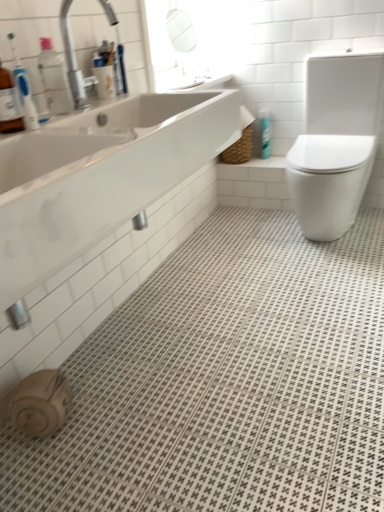
Question: Is silver metallic faucet at upper left to the left of blue glossy spray can at upper right from the viewer's perspective?

Choices:
 (A) yes
 (B) no

Answer: (A)

Question: From the image's perspective, is silver metallic faucet at upper left below blue glossy spray can at upper right?

Choices:
 (A) no
 (B) yes

Answer: (B)

Question: Considering the relative sizes of silver metallic faucet at upper left and blue glossy spray can at upper right in the image provided, is silver metallic faucet at upper left wider than blue glossy spray can at upper right?

Choices:
 (A) yes
 (B) no

Answer: (A)

Question: Considering the relative sizes of silver metallic faucet at upper left and blue glossy spray can at upper right in the image provided, is silver metallic faucet at upper left taller than blue glossy spray can at upper right?

Choices:
 (A) yes
 (B) no

Answer: (A)

Question: Is silver metallic faucet at upper left facing towards blue glossy spray can at upper right?

Choices:
 (A) no
 (B) yes

Answer: (A)

Question: From their relative heights in the image, would you say blue glossy spray can at upper right is taller or shorter than white glossy toilet at right?

Choices:
 (A) short
 (B) tall

Answer: (A)

Question: Considering their positions, is blue glossy spray can at upper right located in front of or behind white glossy toilet at right?

Choices:
 (A) behind
 (B) front

Answer: (A)

Question: From a real-world perspective, is blue glossy spray can at upper right physically located above or below white glossy toilet at right?

Choices:
 (A) above
 (B) below

Answer: (B)

Question: From the image's perspective, is blue glossy spray can at upper right above or below white glossy toilet at right?

Choices:
 (A) below
 (B) above

Answer: (B)

Question: Is point (79, 89) positioned closer to the camera than point (309, 190)?

Choices:
 (A) closer
 (B) farther

Answer: (A)

Question: From the image's perspective, is silver metallic faucet at upper left positioned above or below white glossy toilet at right?

Choices:
 (A) above
 (B) below

Answer: (A)

Question: In the image, is silver metallic faucet at upper left positioned in front of or behind white glossy toilet at right?

Choices:
 (A) front
 (B) behind

Answer: (A)

Question: In terms of width, does silver metallic faucet at upper left look wider or thinner when compared to white glossy toilet at right?

Choices:
 (A) thin
 (B) wide

Answer: (A)

Question: From the image's perspective, is silver metallic faucet at upper left located above or below white glossy sink at upper left?

Choices:
 (A) above
 (B) below

Answer: (A)

Question: In terms of width, does silver metallic faucet at upper left look wider or thinner when compared to white glossy sink at upper left?

Choices:
 (A) wide
 (B) thin

Answer: (B)